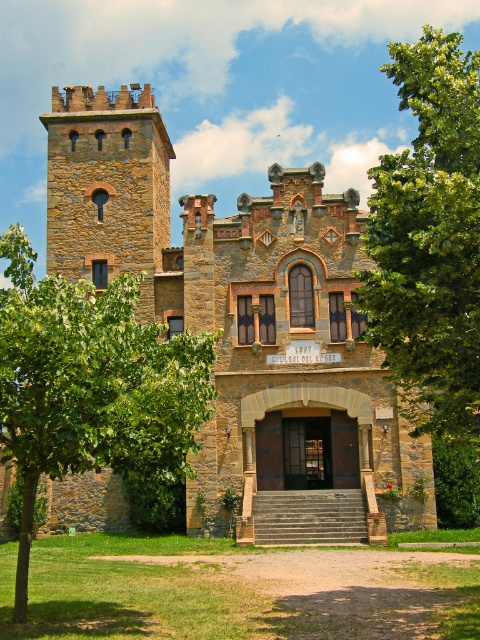
Is green leafy tree at center bigger than rustic stone tower at upper left?

Yes, green leafy tree at center is bigger than rustic stone tower at upper left.

Between green leafy tree at center and rustic stone tower at upper left, which one is positioned higher?

rustic stone tower at upper left is above.

Locate an element on the screen. green leafy tree at center is located at coordinates (92, 385).

Does brown stone castle at center have a lesser width compared to green leafy tree at center?

No.

Can you confirm if brown stone castle at center is positioned above green leafy tree at center?

Indeed, brown stone castle at center is positioned over green leafy tree at center.

At what (x,y) coordinates should I click in order to perform the action: click on brown stone castle at center. Please return your answer as a coordinate pair (x, y). The height and width of the screenshot is (640, 480). Looking at the image, I should click on (240, 308).

Who is taller, green leafy tree at center or green leafy tree at upper right?

With more height is green leafy tree at upper right.

Which of these two, green leafy tree at center or green leafy tree at upper right, stands shorter?

Standing shorter between the two is green leafy tree at center.

Which is in front, point (4, 340) or point (403, 193)?

Positioned in front is point (4, 340).

Image resolution: width=480 pixels, height=640 pixels. I want to click on green leafy tree at center, so click(92, 385).